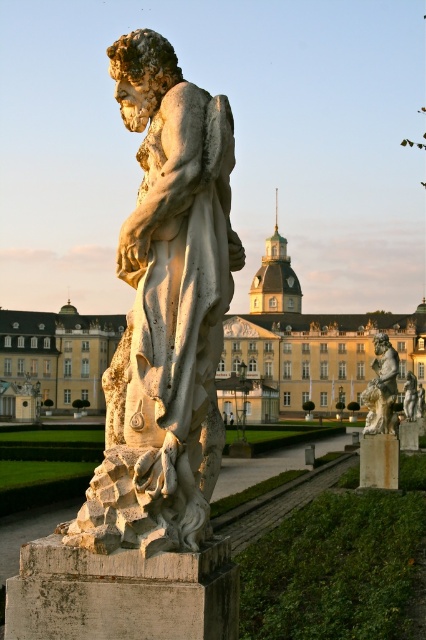
Can you confirm if bronze textured cherub at center is smaller than stone pillar at center?

No, bronze textured cherub at center is not smaller than stone pillar at center.

Does point (377, 406) lie in front of point (394, 477)?

That is False.

Is point (376, 365) behind point (376, 468)?

Yes, point (376, 365) is farther from viewer.

Locate an element on the screen. bronze textured cherub at center is located at coordinates (382, 388).

Based on the photo, who is lower down, white marble statue at center or golden stone palace at center?

golden stone palace at center

From the picture: Does white marble statue at center appear on the left side of golden stone palace at center?

Incorrect, white marble statue at center is not on the left side of golden stone palace at center.

Does point (170, 49) come farther from viewer compared to point (276, 310)?

No, it is not.

The height and width of the screenshot is (640, 426). What are the coordinates of `white marble statue at center` in the screenshot? It's located at (166, 310).

Image resolution: width=426 pixels, height=640 pixels. Describe the element at coordinates (307, 346) in the screenshot. I see `golden stone palace at center` at that location.

Is golden stone palace at center above smooth stone pillar at center?

No.

Measure the distance between point (311, 390) and camera.

Point (311, 390) is 173.34 meters from camera.

Identify the location of golden stone palace at center. (307, 346).